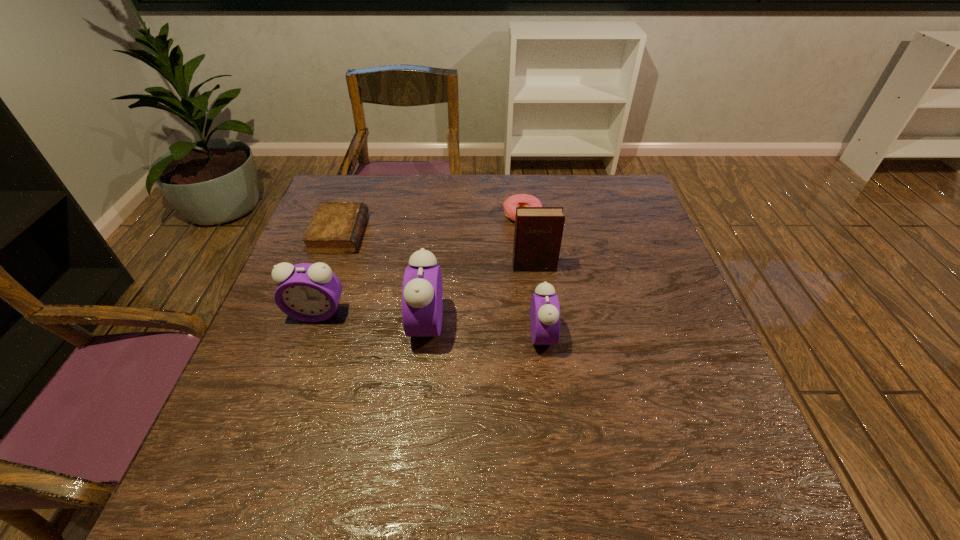
The height and width of the screenshot is (540, 960). Find the location of `vacant area between the farther diary and the second alarm clock from left to right`. vacant area between the farther diary and the second alarm clock from left to right is located at coordinates (383, 279).

At what (x,y) coordinates should I click in order to perform the action: click on vacant space that is in between the third shortest object and the third object from left to right. Please return your answer as a coordinate pair (x, y). The width and height of the screenshot is (960, 540). Looking at the image, I should click on (x=485, y=329).

Locate an element on the screen. This screenshot has width=960, height=540. the third closest object relative to the farther diary is located at coordinates (518, 200).

Find the location of a particular element. the fifth closest object to the fourth object from right to left is located at coordinates (518, 200).

Locate which alarm clock ranks in proximity to the shortest alarm clock. Please provide its 2D coordinates. Your answer should be formatted as a tuple, i.e. [(x, y)], where the tuple contains the x and y coordinates of a point satisfying the conditions above.

[(422, 292)]

Select which alarm clock is the closest to the second tallest alarm clock. Please provide its 2D coordinates. Your answer should be formatted as a tuple, i.e. [(x, y)], where the tuple contains the x and y coordinates of a point satisfying the conditions above.

[(422, 292)]